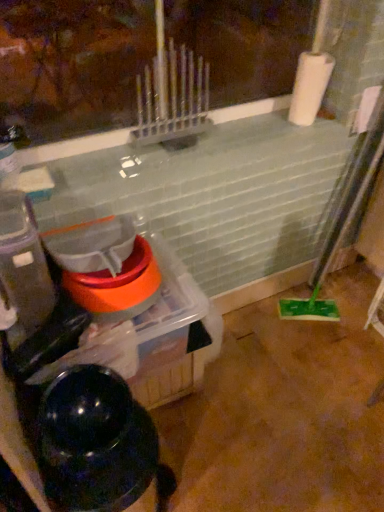
Question: From a real-world perspective, is black glossy water heater at lower left positioned above or below translucent plastic container at left?

Choices:
 (A) above
 (B) below

Answer: (B)

Question: Is black glossy water heater at lower left inside or outside of translucent plastic container at left?

Choices:
 (A) outside
 (B) inside

Answer: (A)

Question: Estimate the real-world distances between objects in this image. Which object is farther from the black glossy water heater at lower left?

Choices:
 (A) translucent plastic container at left
 (B) white matte paper towel at upper right
 (C) white matte toilet paper at upper right

Answer: (C)

Question: Which of these objects is positioned closest to the white matte paper towel at upper right?

Choices:
 (A) black glossy water heater at lower left
 (B) translucent plastic container at left
 (C) white matte toilet paper at upper right

Answer: (C)